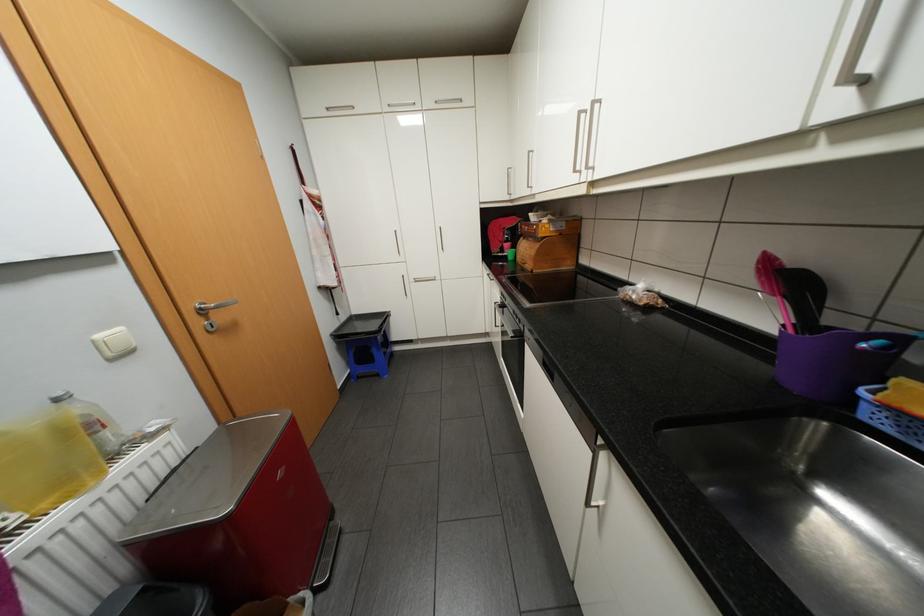
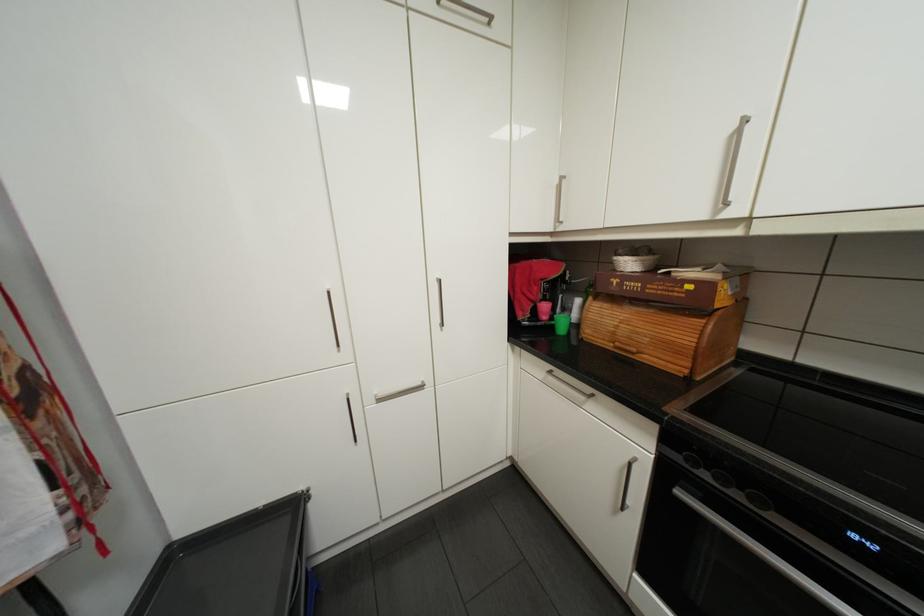
In the second image, find the point that corresponds to point (514, 256) in the first image.

(557, 328)